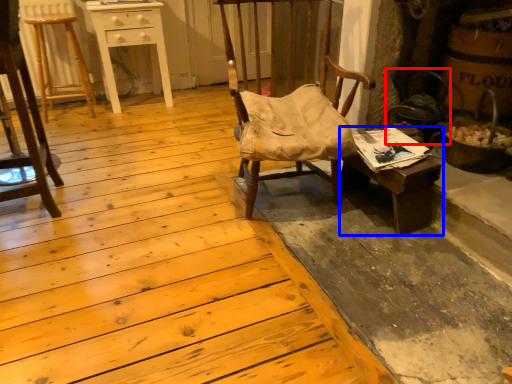
Question: Which object is closer to the camera taking this photo, swivel chair (highlighted by a red box) or desk (highlighted by a blue box)?

Choices:
 (A) swivel chair
 (B) desk

Answer: (B)